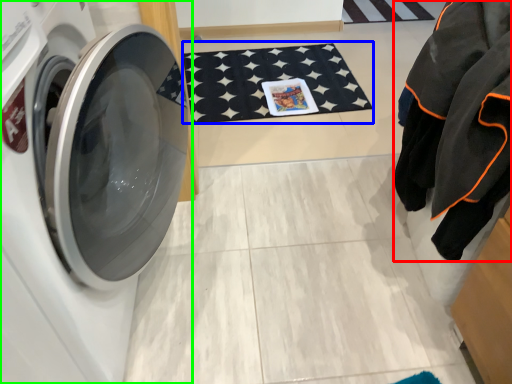
Question: Which object is the farthest from clothing (highlighted by a red box)? Choose among these: bath mat (highlighted by a blue box) or washing machine (highlighted by a green box).

Choices:
 (A) bath mat
 (B) washing machine

Answer: (A)